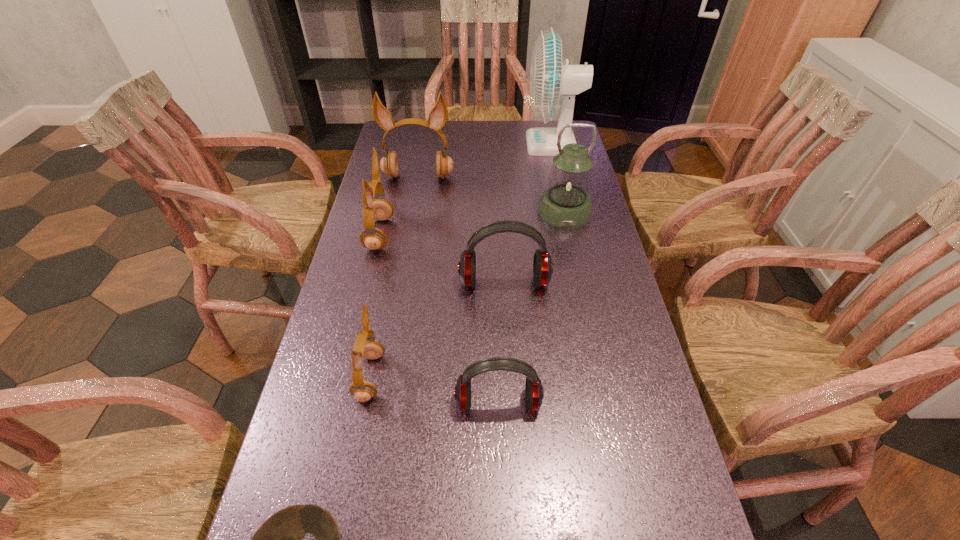
The width and height of the screenshot is (960, 540). What are the coordinates of `the smaller red earphone` in the screenshot? It's located at (534, 391).

The width and height of the screenshot is (960, 540). I want to click on the shortest earphone, so click(x=534, y=391).

This screenshot has height=540, width=960. I want to click on blank space located 0.390m in front of the farthest object to face the airflow, so click(421, 145).

At what (x,y) coordinates should I click in order to perform the action: click on vacant region located 0.290m in front of the farthest object to face the airflow. Please return your answer as a coordinate pair (x, y). Looking at the image, I should click on (448, 145).

The height and width of the screenshot is (540, 960). Find the location of `vacant area situated 0.370m in front of the farthest object to face the airflow`. vacant area situated 0.370m in front of the farthest object to face the airflow is located at coordinates 427,145.

Find the location of a particular element. Image resolution: width=960 pixels, height=540 pixels. blank area located 0.100m on the front-facing side of the biggest brown earphone is located at coordinates (414, 203).

Image resolution: width=960 pixels, height=540 pixels. Identify the location of free region located on the back of the lantern. (556, 172).

The width and height of the screenshot is (960, 540). In order to click on vacant area situated 0.290m on the front-facing side of the second nearest brown earphone in this screenshot , I will do `click(492, 234)`.

Locate an element on the screen. The image size is (960, 540). free space located 0.270m on the ear cups of the farther red earphone is located at coordinates (511, 390).

This screenshot has height=540, width=960. I want to click on free space located on the front-facing side of the nearest brown earphone, so click(x=475, y=376).